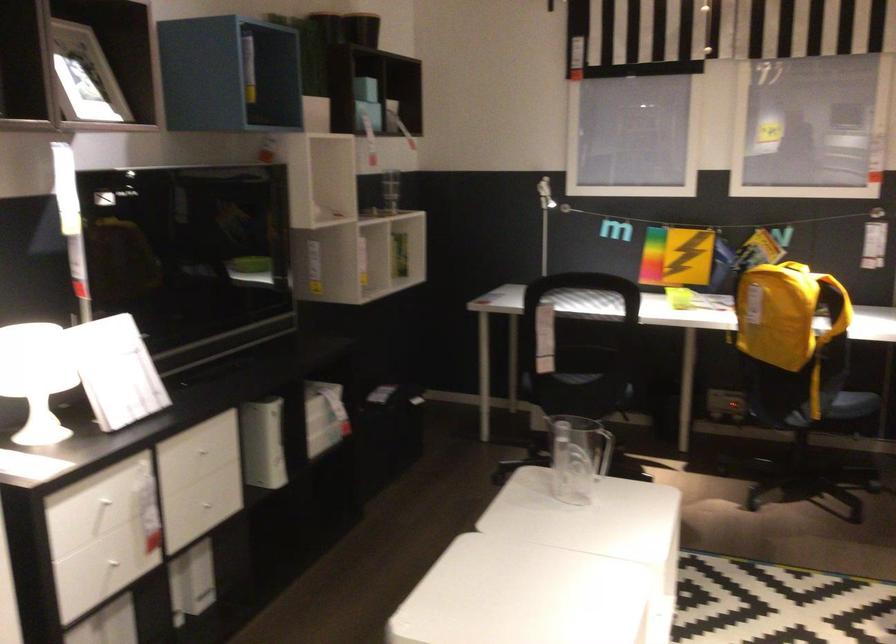
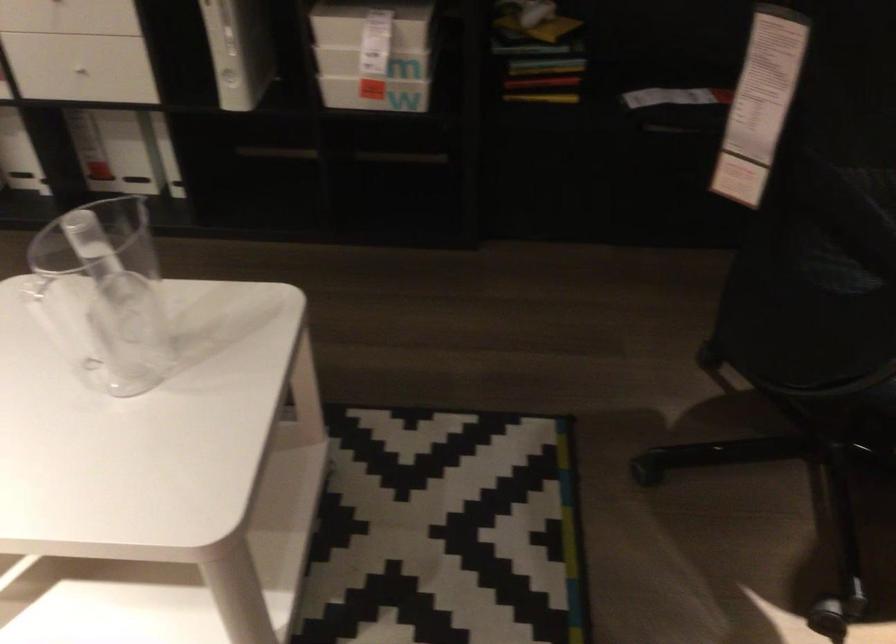
Locate, in the second image, the point that corresponds to (330,442) in the first image.

(375, 93)